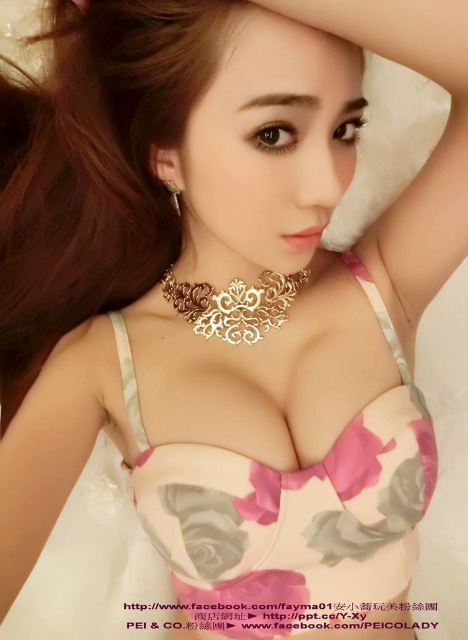
You are a fashion designer trying to create a new outfit. You have the pink floral fabric bikini top at center and the gold metallic necklace at center in front of you. Which object has a greater width?

The pink floral fabric bikini top at center has a greater width than the gold metallic necklace at center.

You are a photographer adjusting the focus on your camera. You want to ensure that both the pink floral fabric bikini top at center and the gold metallic necklace at center are in sharp focus. Based on their positions, which object should you focus on first to achieve this?

You should focus on the pink floral fabric bikini top at center first because it is closer to the viewer than the gold metallic necklace at center. By focusing on the closer object, the necklace will also come into focus due to the depth of field.

In the scene shown: You are a photographer setting up a shoot and want to ensure that both the pink floral fabric bikini top at center and the gold metallic necklace at center are clearly visible in the frame. Given their sizes, which one should you focus on first to ensure proper framing?

The pink floral fabric bikini top at center is bigger than the gold metallic necklace at center, so you should focus on the pink floral fabric bikini top at center first to ensure proper framing since it occupies more space in the frame.